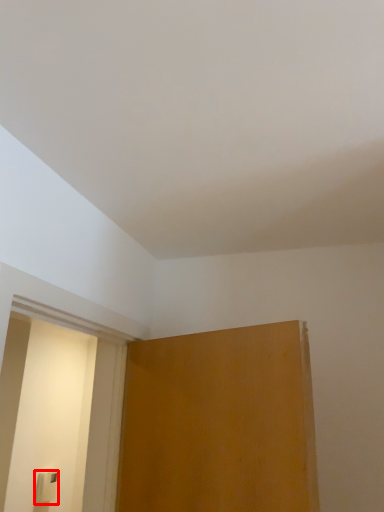
Question: From the image's perspective, what is the correct spatial positioning of light switch (annotated by the red box) in reference to screen door?

Choices:
 (A) above
 (B) below

Answer: (B)